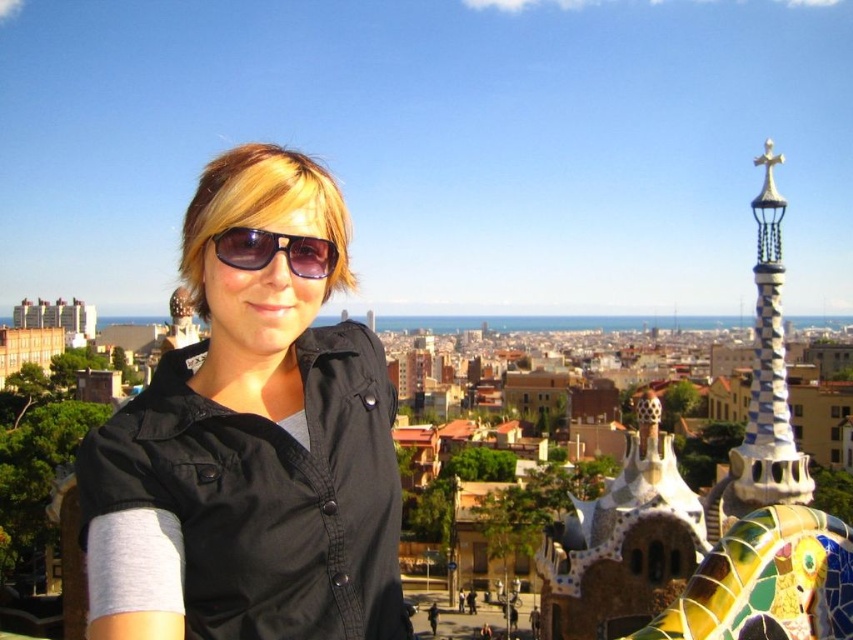
Question: Which of the following is the closest to the observer?

Choices:
 (A) matte black sunglasses at center
 (B) multicolored mosaic spire at upper right
 (C) black matte shirt at center

Answer: (C)

Question: Does black matte shirt at center appear on the right side of matte black sunglasses at center?

Choices:
 (A) yes
 (B) no

Answer: (B)

Question: Is black matte shirt at center positioned behind multicolored mosaic spire at upper right?

Choices:
 (A) no
 (B) yes

Answer: (A)

Question: Is black matte shirt at center in front of multicolored mosaic spire at upper right?

Choices:
 (A) no
 (B) yes

Answer: (B)

Question: Considering the real-world distances, which object is closest to the black matte shirt at center?

Choices:
 (A) matte black sunglasses at center
 (B) multicolored mosaic spire at upper right

Answer: (A)

Question: Which of the following is the closest to the observer?

Choices:
 (A) black matte shirt at center
 (B) multicolored mosaic spire at upper right

Answer: (A)